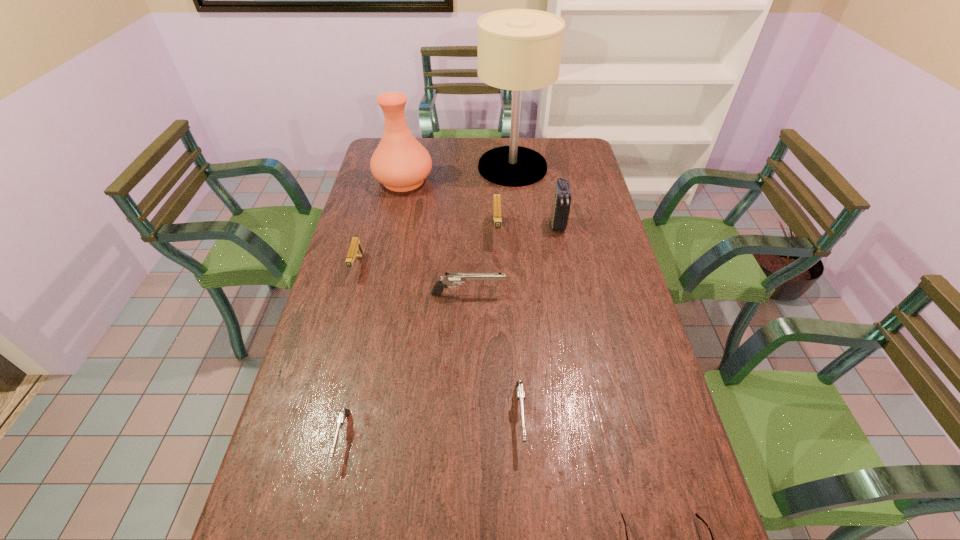
Identify the location of vacant area that lies between the leftmost pistol and the third tallest object. (457, 245).

You are a GUI agent. You are given a task and a screenshot of the screen. Output one action in this format:
    pyautogui.click(x=<x>, y=<y>)
    Task: Click on the free space between the second silver pistol from left to right and the right tan pistol
    
    Given the screenshot: What is the action you would take?
    pyautogui.click(x=482, y=262)

The width and height of the screenshot is (960, 540). In order to click on unoccupied position between the smallest silver pistol and the table lamp in this screenshot , I will do `click(427, 302)`.

Identify the location of free area in between the tallest object and the eighth shortest object. coord(458,173).

Locate an element on the screen. Image resolution: width=960 pixels, height=540 pixels. unoccupied area between the clutch bag and the right tan pistol is located at coordinates (527, 227).

Where is `vacant space that's between the fourth nearest object and the bigger tan pistol`? Image resolution: width=960 pixels, height=540 pixels. vacant space that's between the fourth nearest object and the bigger tan pistol is located at coordinates (482, 262).

At what (x,y) coordinates should I click in order to perform the action: click on object that is the seventh nearest to the second silver pistol from right to left. Please return your answer as a coordinate pair (x, y). Image resolution: width=960 pixels, height=540 pixels. Looking at the image, I should click on (518, 49).

Point out which object is positioned as the nearest to the vase. Please provide its 2D coordinates. Your answer should be formatted as a tuple, i.e. [(x, y)], where the tuple contains the x and y coordinates of a point satisfying the conditions above.

[(518, 49)]

Choose which pistol is the fifth nearest neighbor to the beige table lamp. Please provide its 2D coordinates. Your answer should be formatted as a tuple, i.e. [(x, y)], where the tuple contains the x and y coordinates of a point satisfying the conditions above.

[(344, 413)]

Identify the location of pistol identified as the closest to the table lamp. (497, 219).